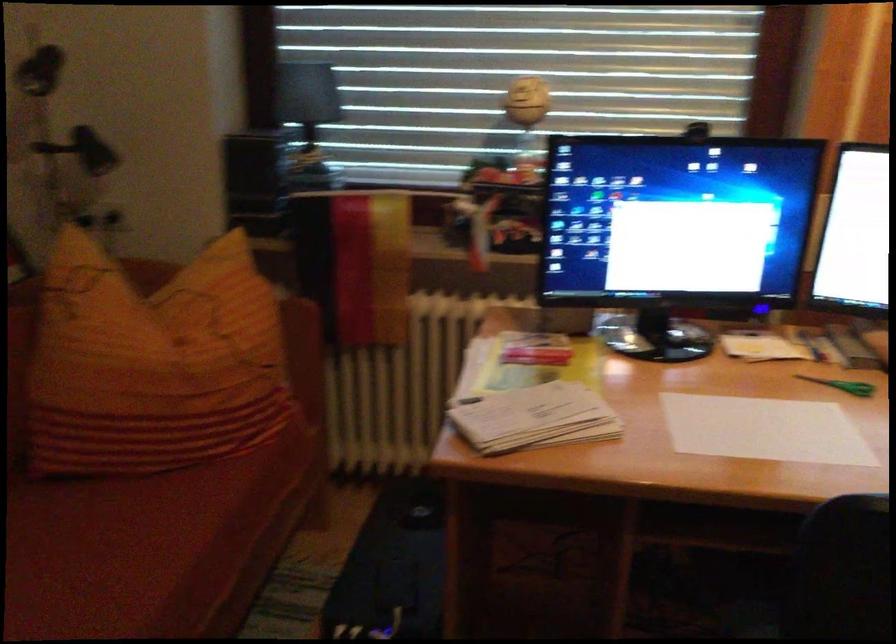
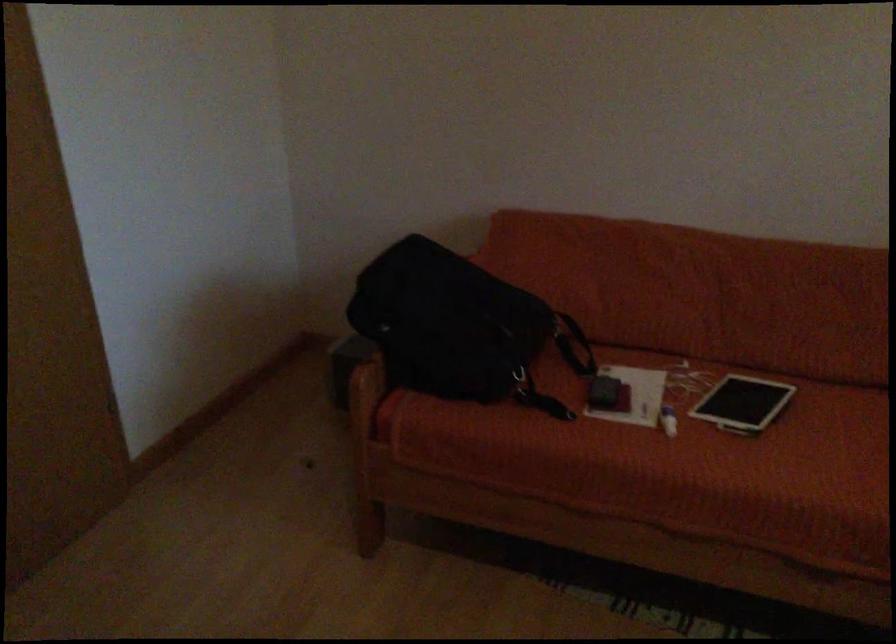
Based on the photo, the first image is from the beginning of the video and the second image is from the end. How did the camera likely rotate when shooting the video?

The camera's rotation is toward left-down.